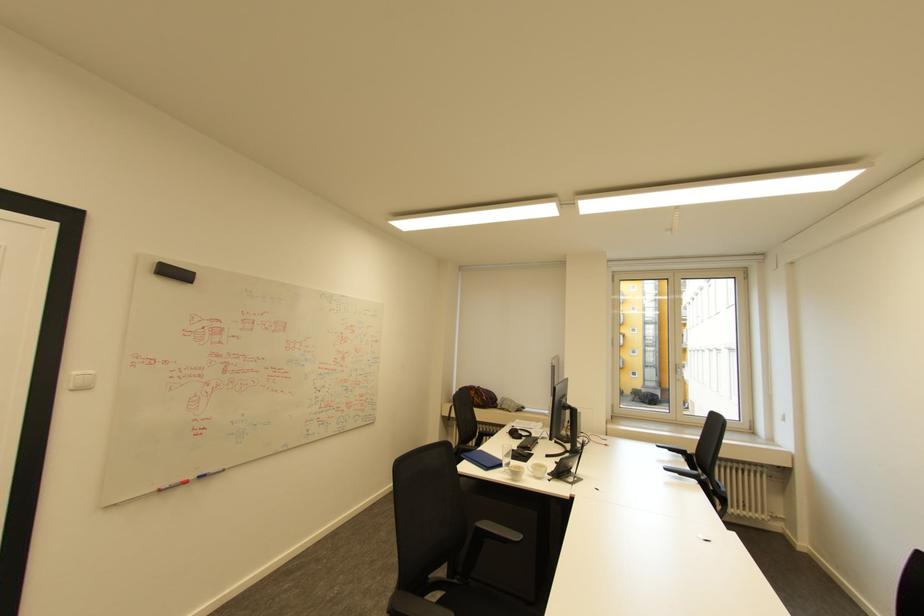
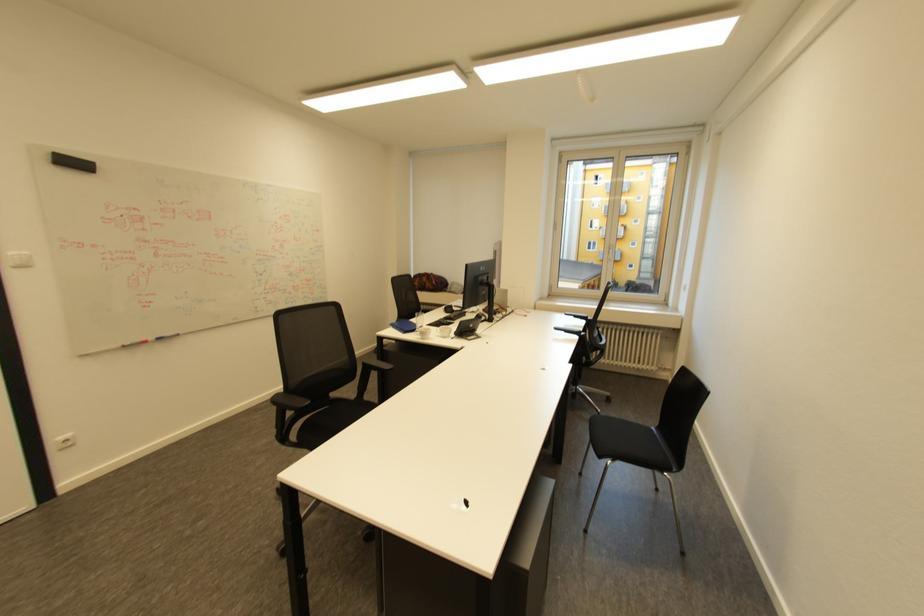
The point at (640, 389) is marked in the first image. Where is the corresponding point in the second image?

(636, 281)